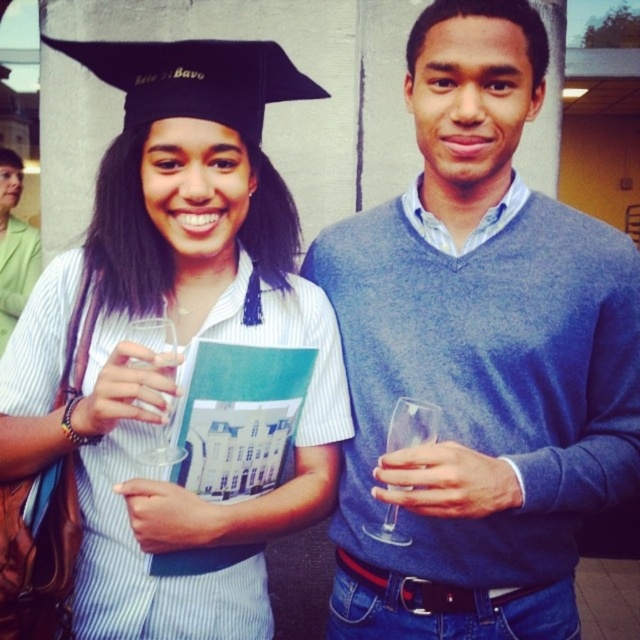
Looking at this image, who is positioned more to the left, blue sweater at center or transparent glass wine glass at right?

Positioned to the left is transparent glass wine glass at right.

Between point (369, 474) and point (397, 435), which one is positioned behind?

Positioned behind is point (369, 474).

Identify the location of blue sweater at center. The image size is (640, 640). (477, 356).

Is matte black graduation cap at upper left bigger than transparent glass wine glass at right?

Correct, matte black graduation cap at upper left is larger in size than transparent glass wine glass at right.

Looking at this image, does matte black graduation cap at upper left have a lesser height compared to transparent glass wine glass at right?

Incorrect, matte black graduation cap at upper left's height does not fall short of transparent glass wine glass at right's.

This screenshot has width=640, height=640. I want to click on matte black graduation cap at upper left, so click(x=168, y=364).

Does blue sweater at center have a lesser width compared to transparent glass at left?

Incorrect, blue sweater at center's width is not less than transparent glass at left's.

Looking at this image, can you confirm if blue sweater at center is taller than transparent glass at left?

Indeed, blue sweater at center has a greater height compared to transparent glass at left.

Is point (365, 372) positioned before point (168, 452)?

No, (365, 372) is behind (168, 452).

This screenshot has height=640, width=640. I want to click on blue sweater at center, so click(x=477, y=356).